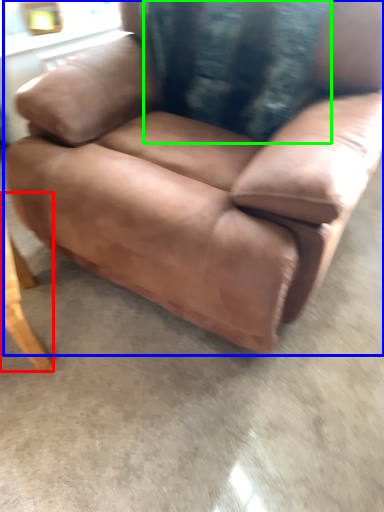
Question: Which object is the farthest from table (highlighted by a red box)? Choose among these: chair (highlighted by a blue box) or pillow (highlighted by a green box).

Choices:
 (A) chair
 (B) pillow

Answer: (B)